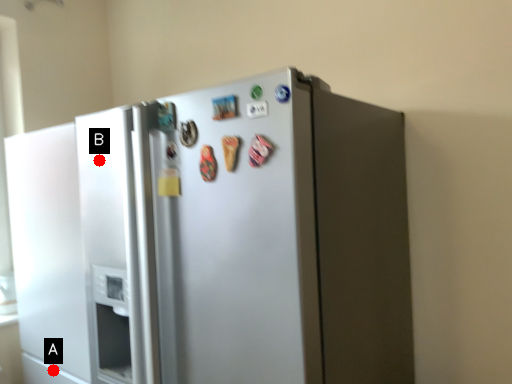
Question: Two points are circled on the image, labeled by A and B beside each circle. Which point is farther to the camera?

Choices:
 (A) A is further
 (B) B is further

Answer: (A)